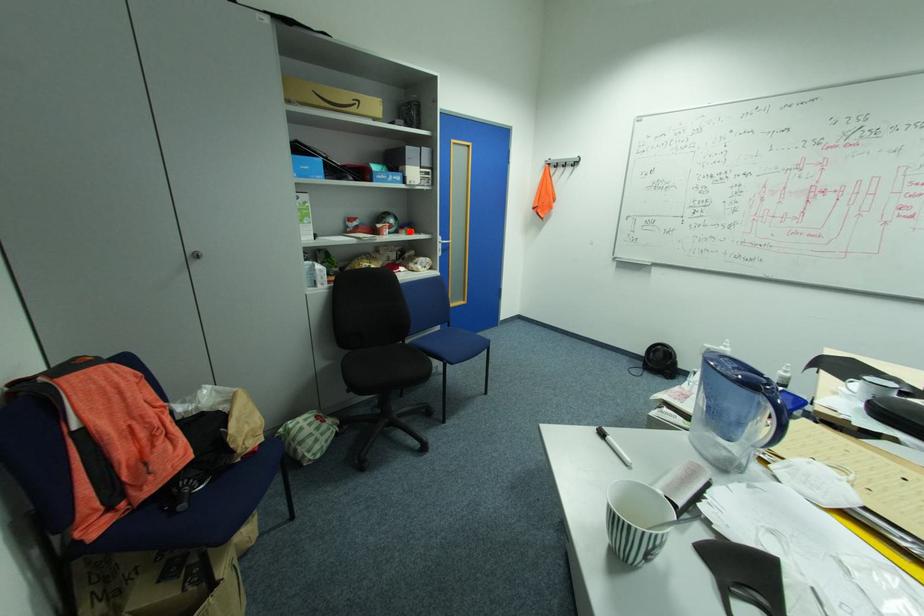
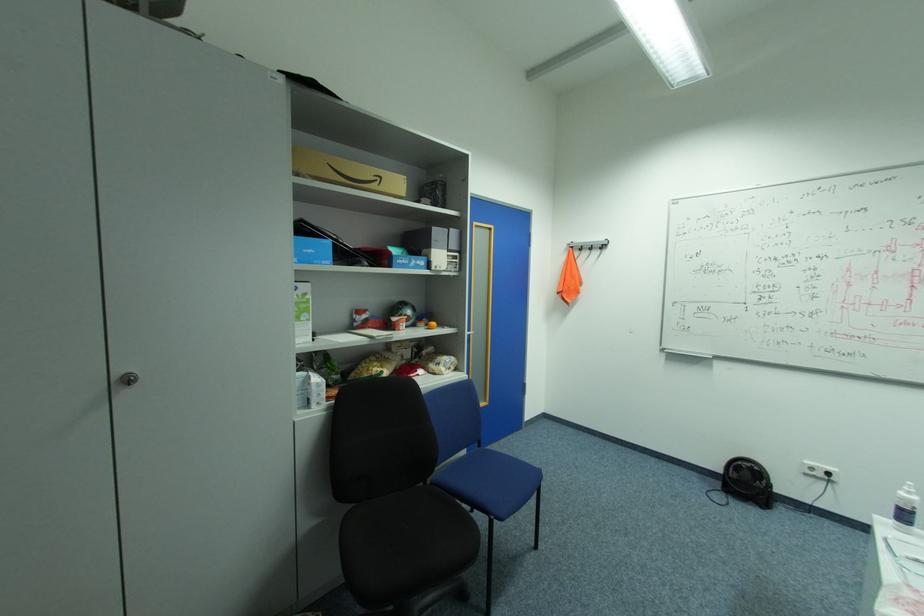
Question: A red point is marked in image1. In image2, is the corresponding 3D point closer to the camera or farther? Reply with the corresponding letter.

Choices:
 (A) The corresponding 3D point is closer.
 (B) The corresponding 3D point is farther.

Answer: (B)